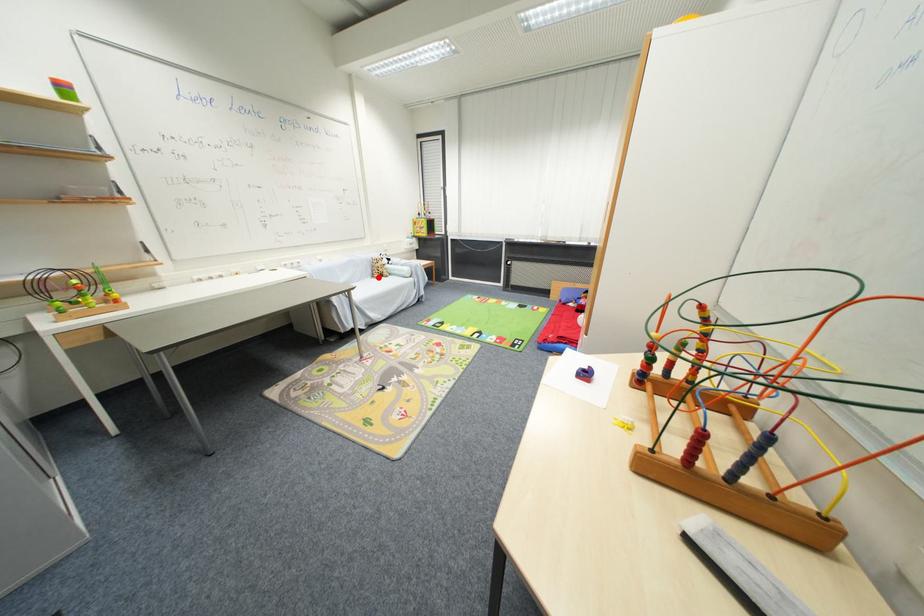
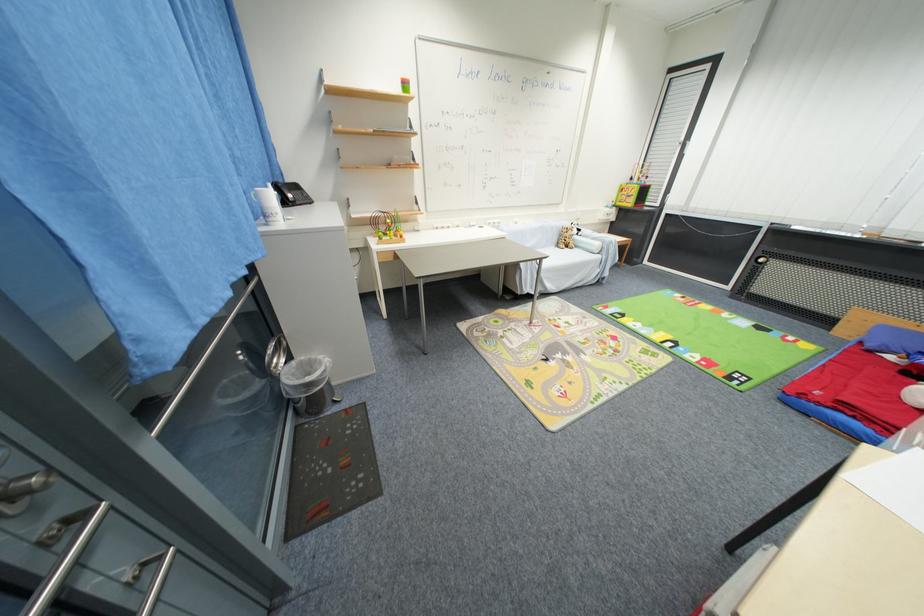
Find the pixel in the second image that matches the highlighted location in the first image.

(563, 246)